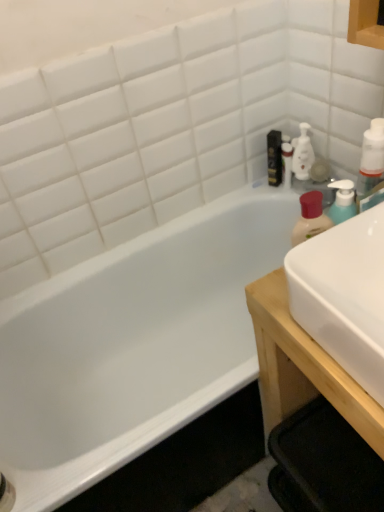
This screenshot has height=512, width=384. What are the coordinates of `vacant space to the left of translucent plastic bottle at upper right` in the screenshot? It's located at (256, 190).